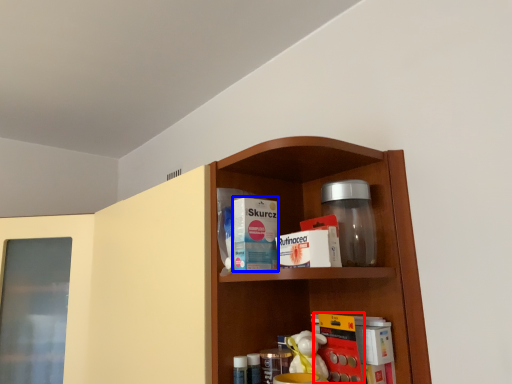
Question: Which point is closer to the camera, book (highlighted by a red box) or product (highlighted by a blue box)?

Choices:
 (A) book
 (B) product

Answer: (A)